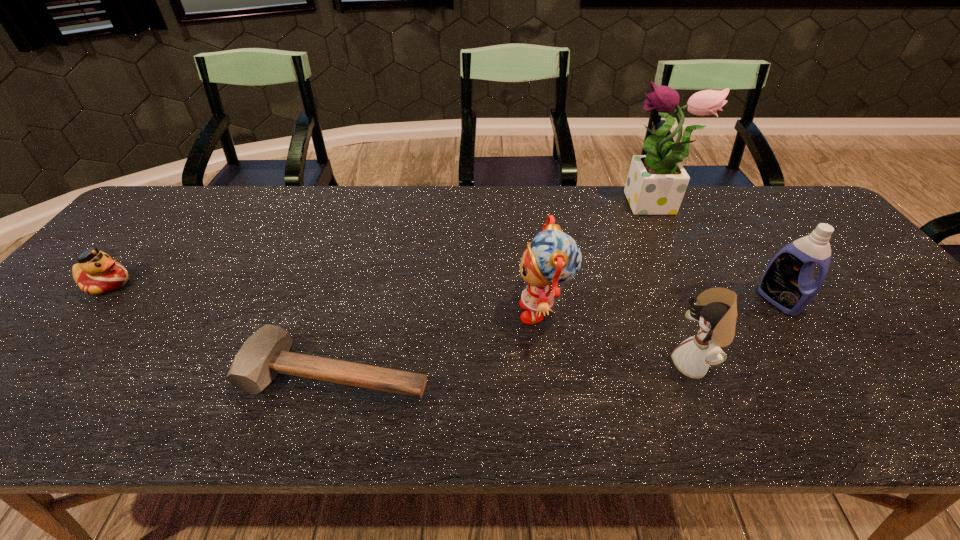
I want to click on vacant area between the second shortest object and the tallest object, so click(380, 245).

You are a GUI agent. You are given a task and a screenshot of the screen. Output one action in this format:
    pyautogui.click(x=<x>, y=<y>)
    Task: Click on the free spot between the flower arrangement and the fourth object from right to left
    This screenshot has height=540, width=960.
    Given the screenshot: What is the action you would take?
    pyautogui.click(x=598, y=259)

This screenshot has width=960, height=540. What are the coordinates of `vacant area that lies between the farthest object and the fourth object from right to left` in the screenshot? It's located at (598, 259).

The height and width of the screenshot is (540, 960). Find the location of `empty location between the right doll and the flower arrangement`. empty location between the right doll and the flower arrangement is located at coordinates (673, 285).

Where is `vacant area between the left doll and the right doll`? The image size is (960, 540). vacant area between the left doll and the right doll is located at coordinates (618, 338).

This screenshot has height=540, width=960. Find the location of `free area in between the left doll and the flower arrangement`. free area in between the left doll and the flower arrangement is located at coordinates (598, 259).

Locate an element on the screen. free space between the right doll and the leftmost object is located at coordinates (400, 324).

You are a GUI agent. You are given a task and a screenshot of the screen. Output one action in this format:
    pyautogui.click(x=<x>, y=<y>)
    Task: Click on the unoccupied area between the leftmost object and the left doll
    
    Given the screenshot: What is the action you would take?
    pyautogui.click(x=325, y=298)

Find the location of a particular element. This screenshot has width=960, height=540. vacant region between the farthest object and the rightmost object is located at coordinates (715, 253).

Select which object is the fifth closest to the rightmost object. Please provide its 2D coordinates. Your answer should be formatted as a tuple, i.e. [(x, y)], where the tuple contains the x and y coordinates of a point satisfying the conditions above.

[(96, 273)]